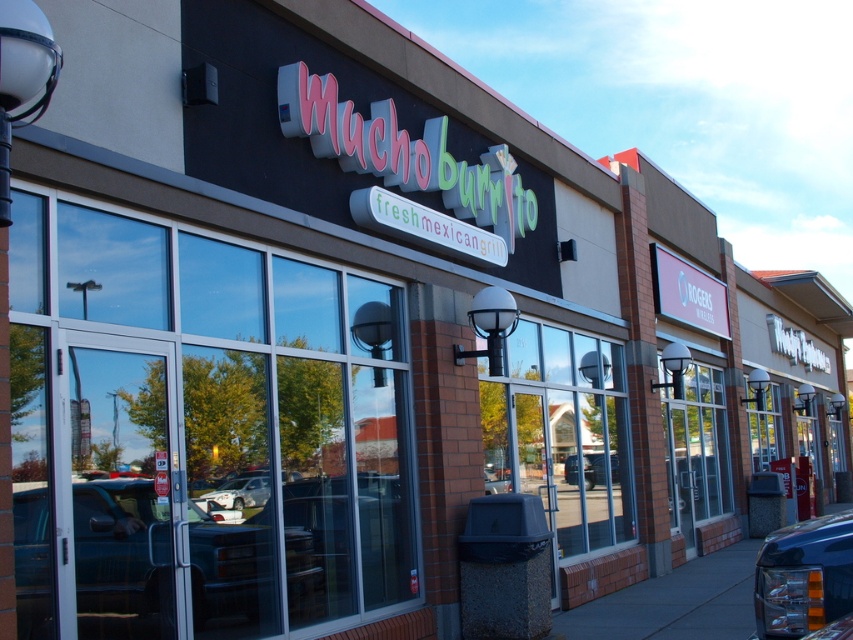
You are standing in front of the Mucho Burrito restaurant and notice two points on the building facade. The first point is at coordinates point (786,547) and the second is at point (596,474). Which of these points is closer to you?

Point (786,547) is closer to the viewer than point (596,474).

You are a customer approaching the Mucho Burrito restaurant and notice the shiny black car at center and the gray concrete sidewalk at lower right. Which object is positioned higher from the ground?

The shiny black car at center is above gray concrete sidewalk at lower right, so it is positioned higher from the ground.

You are standing in front of the Mucho Burrito restaurant and want to take a photo of the shiny black car at center and the gray concrete sidewalk at lower right. Which object should you focus on first to ensure both are in sharp focus?

The shiny black car at center is closer to the viewer than the gray concrete sidewalk at lower right. To ensure both are in sharp focus, focus on the shiny black car at center since it is closer, and the gray concrete sidewalk at lower right will fall within the depth of field.